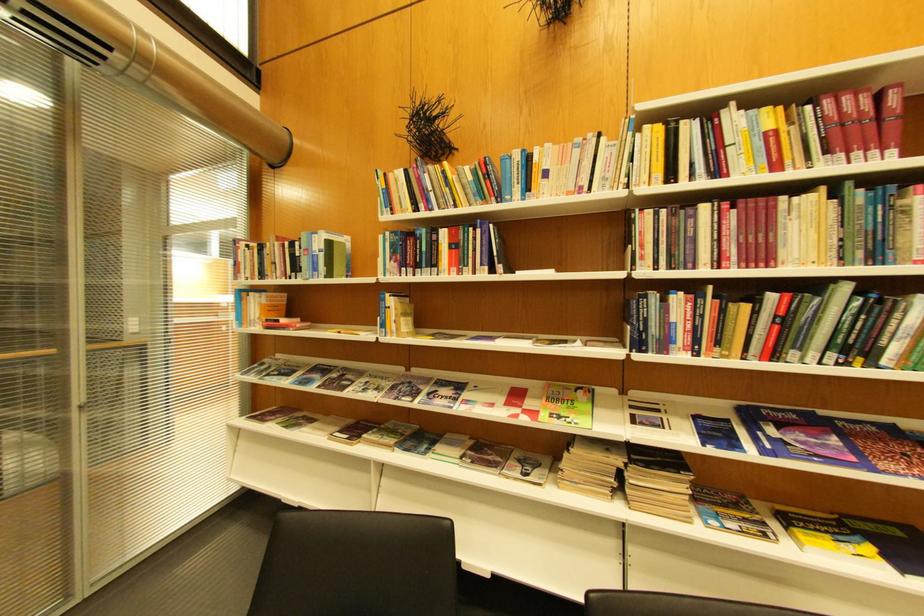
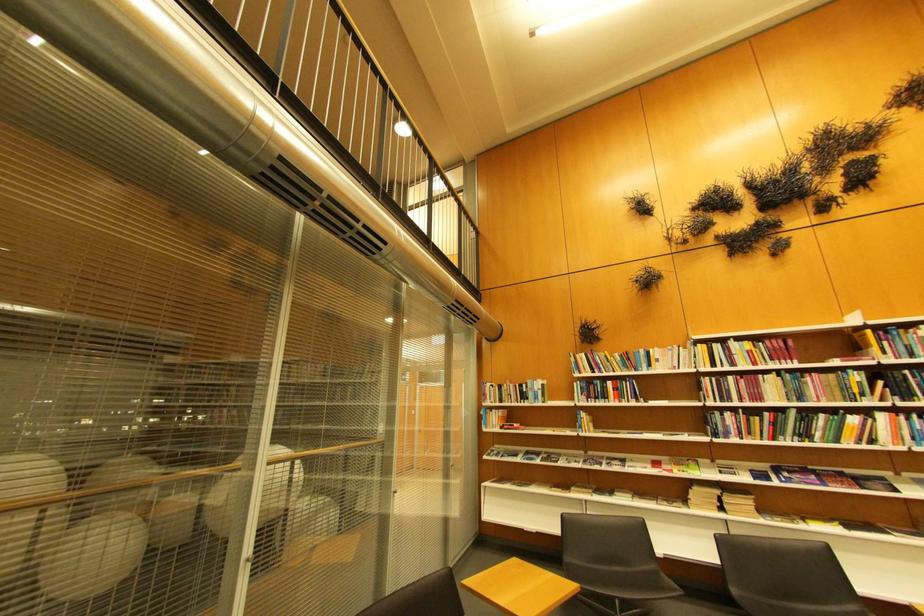
Looking at this image, the images are taken continuously from a first-person perspective. In which direction are you moving?

The cameraman moved toward left, backward.